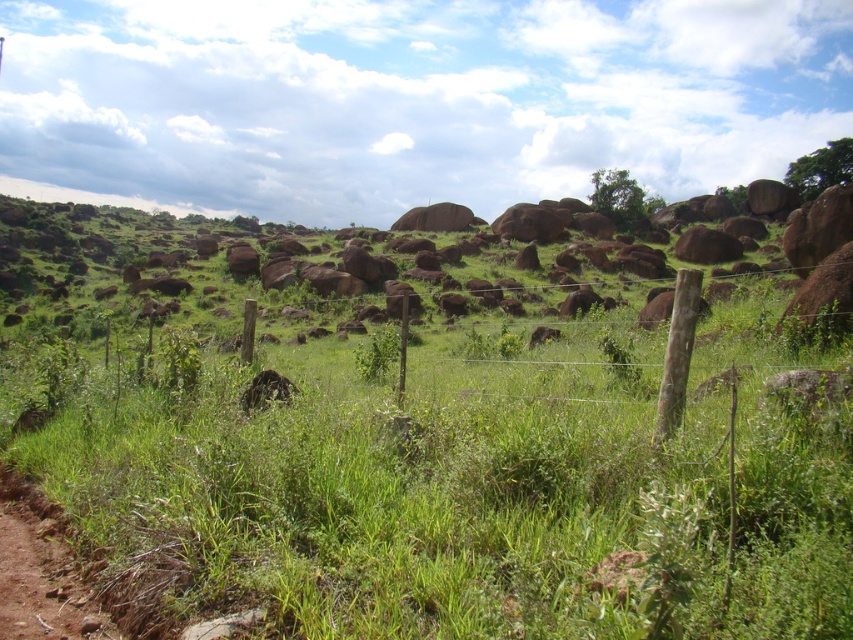
In the scene shown: Which of these two, green grassy at center or brown fuzzy animal at center, stands taller?

green grassy at center

Does point (73, 394) lie in front of point (260, 401)?

That is False.

Where is `green grassy at center`? The width and height of the screenshot is (853, 640). green grassy at center is located at coordinates (461, 490).